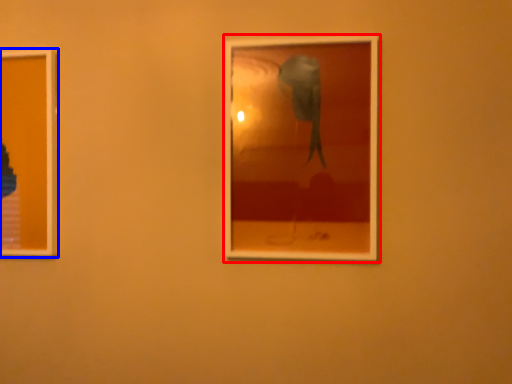
Question: Which point is further to the camera, picture frame (highlighted by a red box) or picture frame (highlighted by a blue box)?

Choices:
 (A) picture frame
 (B) picture frame

Answer: (B)